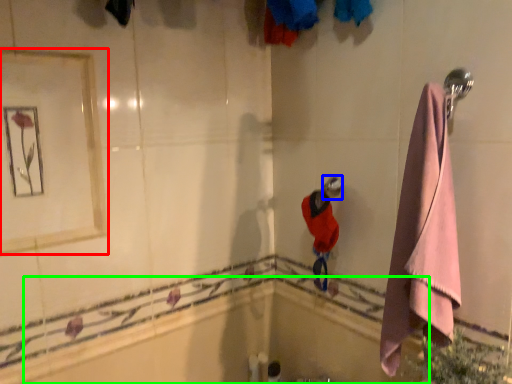
Question: Which is nearer to the mirror (highlighted by a red box)? shower (highlighted by a blue box) or bath (highlighted by a green box).

Choices:
 (A) shower
 (B) bath

Answer: (B)